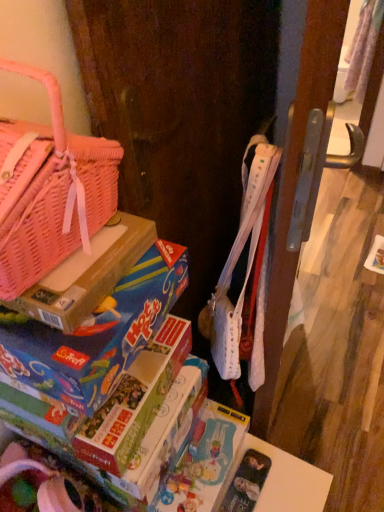
Where is `cardboard box at left`? The image size is (384, 512). cardboard box at left is located at coordinates (87, 275).

Identify the location of pink woven basket at upper left. The width and height of the screenshot is (384, 512). (51, 192).

The width and height of the screenshot is (384, 512). What do you see at coordinates (135, 400) in the screenshot?
I see `matte cardboard book at lower left` at bounding box center [135, 400].

Identify the location of cardboard box at left. This screenshot has width=384, height=512. (87, 275).

Does cardboard box at left have a smaller size compared to pink woven basket at upper left?

Correct, cardboard box at left occupies less space than pink woven basket at upper left.

From the image's perspective, is cardboard box at left located beneath pink woven basket at upper left?

Indeed, from the image's perspective, cardboard box at left is shown beneath pink woven basket at upper left.

Considering the sizes of objects cardboard box at left and pink woven basket at upper left in the image provided, who is thinner, cardboard box at left or pink woven basket at upper left?

Thinner between the two is pink woven basket at upper left.

Considering the positions of objects cardboard box at left and pink woven basket at upper left in the image provided, who is behind, cardboard box at left or pink woven basket at upper left?

cardboard box at left is further from the camera.

Which is more to the left, pink woven basket at upper left or cardboard box at left?

Positioned to the left is pink woven basket at upper left.

Considering the sizes of objects pink woven basket at upper left and cardboard box at left in the image provided, who is smaller, pink woven basket at upper left or cardboard box at left?

cardboard box at left.

Based on the photo, is cardboard box at left located within pink woven basket at upper left?

No, cardboard box at left is not surrounded by pink woven basket at upper left.

Is pink woven basket at upper left not near cardboard box at left?

pink woven basket at upper left is actually quite close to cardboard box at left.

Between matte cardboard book at lower left and cardboard box at left, which one is positioned in front?

cardboard box at left is more forward.

Is cardboard box at left located within matte cardboard book at lower left?

Definitely not — cardboard box at left is not inside matte cardboard book at lower left.

Identify the location of cardboard box to the left of matte cardboard book at lower left. Image resolution: width=384 pixels, height=512 pixels. (87, 275).

From a real-world perspective, which object stands above the other?

In real-world perspective, cardboard box at left is above.

From a real-world perspective, is matte cardboard book at lower left physically located above or below pink woven basket at upper left?

matte cardboard book at lower left is situated lower than pink woven basket at upper left in the real world.

Is matte cardboard book at lower left oriented away from pink woven basket at upper left?

That's not correct — matte cardboard book at lower left is not looking away from pink woven basket at upper left.

The image size is (384, 512). Identify the location of handbag above the matte cardboard book at lower left (from a real-world perspective). (51, 192).

Is matte cardboard book at lower left not close to pink woven basket at upper left?

No, matte cardboard book at lower left is in close proximity to pink woven basket at upper left.

From a real-world perspective, is cardboard box at left below matte cardboard book at lower left?

No, from a real-world perspective, cardboard box at left is not below matte cardboard book at lower left.

Can you confirm if cardboard box at left is positioned to the right of matte cardboard book at lower left?

No, cardboard box at left is not to the right of matte cardboard book at lower left.

Between cardboard box at left and matte cardboard book at lower left, which one has larger width?

Wider between the two is matte cardboard book at lower left.

Looking at this image, is cardboard box at left facing towards matte cardboard book at lower left?

No, cardboard box at left is not turned towards matte cardboard book at lower left.

Considering the relative sizes of pink woven basket at upper left and matte cardboard book at lower left in the image provided, is pink woven basket at upper left smaller than matte cardboard book at lower left?

Actually, pink woven basket at upper left might be larger than matte cardboard book at lower left.

Is matte cardboard book at lower left surrounded by pink woven basket at upper left?

No.

Does point (31, 270) appear closer or farther from the camera than point (79, 449)?

Point (31, 270) appears to be closer to the viewer than point (79, 449).

Considering the relative sizes of pink woven basket at upper left and matte cardboard book at lower left in the image provided, is pink woven basket at upper left wider than matte cardboard book at lower left?

No.

Identify the location of cardboard box below the pink woven basket at upper left (from the image's perspective). The height and width of the screenshot is (512, 384). (87, 275).

Image resolution: width=384 pixels, height=512 pixels. I want to click on handbag on the left of cardboard box at left, so click(51, 192).

Based on their spatial positions, is pink woven basket at upper left or cardboard box at left further from matte cardboard book at lower left?

pink woven basket at upper left.

Based on their spatial positions, is pink woven basket at upper left or matte cardboard book at lower left further from cardboard box at left?

matte cardboard book at lower left lies further to cardboard box at left than the other object.

When comparing their distances from cardboard box at left, does matte cardboard book at lower left or pink woven basket at upper left seem closer?

pink woven basket at upper left is positioned closer to the anchor cardboard box at left.

Looking at the image, which one is located closer to matte cardboard book at lower left, cardboard box at left or pink woven basket at upper left?

cardboard box at left.

From the image, which object appears to be farther from pink woven basket at upper left, cardboard box at left or matte cardboard book at lower left?

matte cardboard book at lower left is positioned further to the anchor pink woven basket at upper left.

From the image, which object appears to be farther from pink woven basket at upper left, matte cardboard book at lower left or cardboard box at left?

Among the two, matte cardboard book at lower left is located further to pink woven basket at upper left.

At what (x,y) coordinates should I click in order to perform the action: click on cardboard box between pink woven basket at upper left and matte cardboard book at lower left vertically. Please return your answer as a coordinate pair (x, y). This screenshot has width=384, height=512. Looking at the image, I should click on (87, 275).